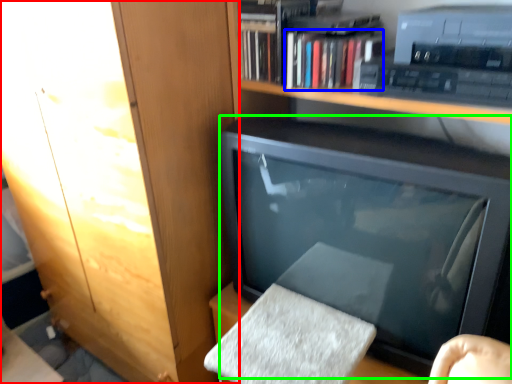
Question: Which object is positioned farthest from cabinetry (highlighted by a red box)? Select from book (highlighted by a blue box) and television (highlighted by a green box).

Choices:
 (A) book
 (B) television

Answer: (A)